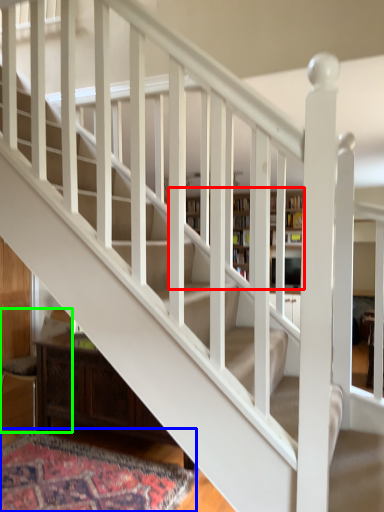
Question: Which is nearer to the bookcase (highlighted by a red box)? mat (highlighted by a blue box) or armchair (highlighted by a green box).

Choices:
 (A) mat
 (B) armchair

Answer: (A)